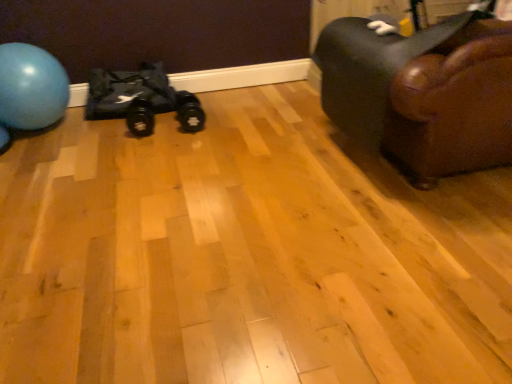
Question: Does point coord(134,109) appear closer or farther from the camera than point coord(180,114)?

Choices:
 (A) closer
 (B) farther

Answer: (A)

Question: Is black rubber dumbbell at center, marked as the first footwear in a left-to-right arrangement, bigger or smaller than black rubber dumbbell at center, the second footwear from the left?

Choices:
 (A) big
 (B) small

Answer: (A)

Question: Estimate the real-world distances between objects in this image. Which object is closer to the blue rubber ball at left?

Choices:
 (A) brown leather couch at right
 (B) black rubber dumbbell at center, the second footwear from the left
 (C) black rubber dumbbell at center, arranged as the second footwear when viewed from the right
 (D) black fabric bag at left

Answer: (D)

Question: Estimate the real-world distances between objects in this image. Which object is farther from the black rubber dumbbell at center, which is the 1th footwear from right to left?

Choices:
 (A) black fabric bag at left
 (B) blue rubber ball at left
 (C) black rubber dumbbell at center, arranged as the second footwear when viewed from the right
 (D) brown leather couch at right

Answer: (D)